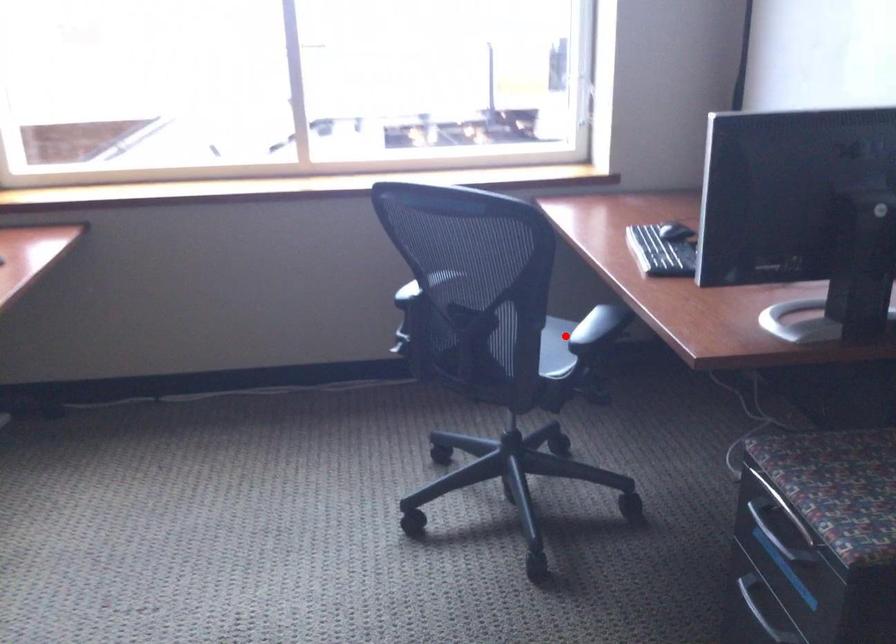
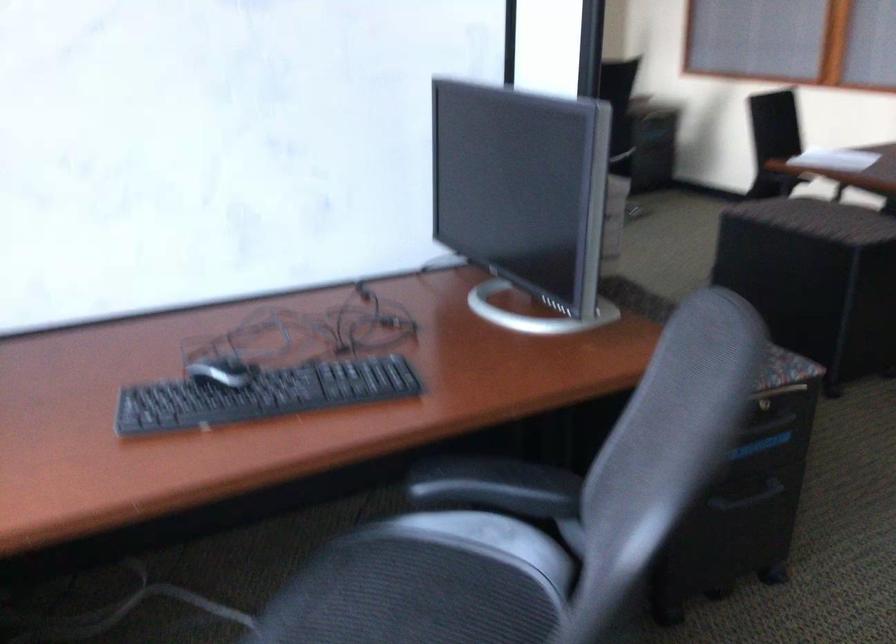
Locate, in the second image, the point that corresponds to the highlighted location in the first image.

(410, 596)